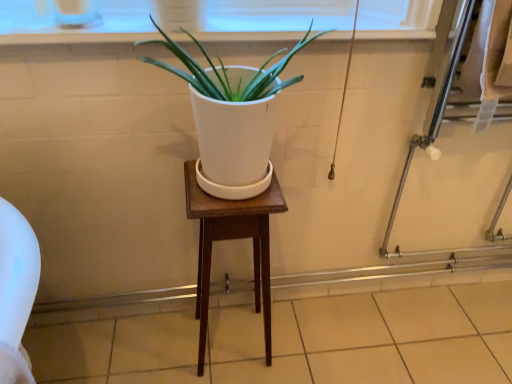
Identify the location of free point to the right of wooden stool at center. Image resolution: width=512 pixels, height=384 pixels. (301, 347).